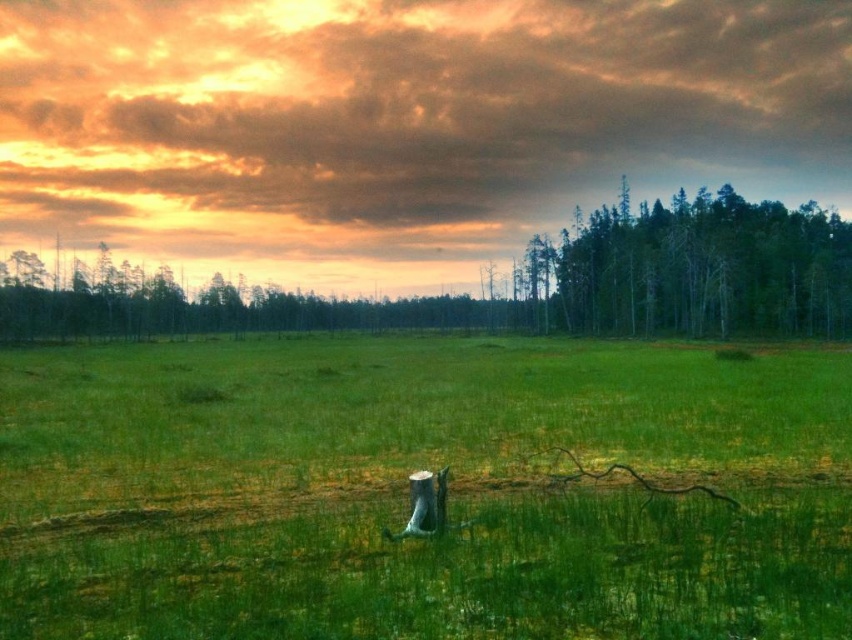
You are a landscape photographer planning to capture the entire scene in one shot. Given that the green grassy pasture at center and the green matte trees at right are both in view, which object will appear smaller in the final photo?

The green grassy pasture at center will appear smaller in the final photo because it occupies less space than the green matte trees at right according to the description.

You are standing in the middle of the green grassy pasture at center and want to walk towards the green matte trees at right. Which direction should you head?

Since the green grassy pasture at center is closer to the viewer than the green matte trees at right, you should head towards the right direction to reach the green matte trees at right.

Based on the scene description, where is the green grassy pasture at center located in terms of its 2D coordinates?

The green grassy pasture at center is located at the 2D coordinates of point (407, 490).